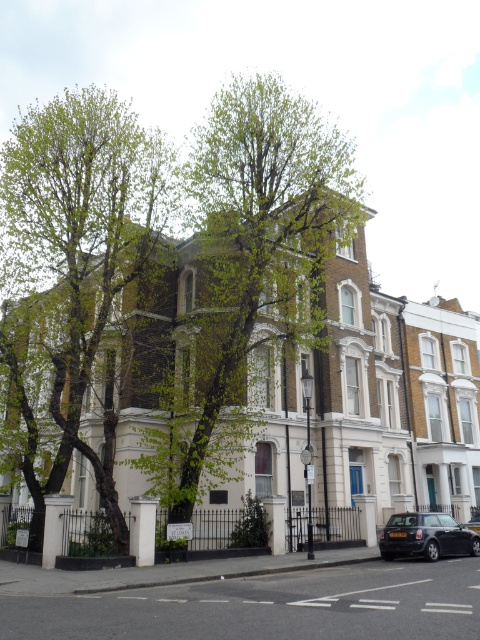
Can you confirm if green leafy tree at center is positioned above black matte car at lower right?

Indeed, green leafy tree at center is positioned over black matte car at lower right.

Does green leafy tree at center appear on the right side of black matte car at lower right?

Incorrect, green leafy tree at center is not on the right side of black matte car at lower right.

Is point (233, 330) positioned in front of point (427, 557)?

No, it is behind (427, 557).

You are a GUI agent. You are given a task and a screenshot of the screen. Output one action in this format:
    pyautogui.click(x=<x>, y=<y>)
    Task: Click on the green leafy tree at center
    Image resolution: width=480 pixels, height=640 pixels.
    Given the screenshot: What is the action you would take?
    pyautogui.click(x=248, y=275)

From the picture: Between black matte car at lower right and shiny black car at center, which one appears on the left side from the viewer's perspective?

black matte car at lower right

Does black matte car at lower right have a greater width compared to shiny black car at center?

No, black matte car at lower right is not wider than shiny black car at center.

Which is behind, point (446, 548) or point (469, 518)?

Positioned behind is point (469, 518).

Find the location of a particular element. black matte car at lower right is located at coordinates (425, 536).

Is green leafy tree at center further to the viewer compared to green leafy tree at left?

Yes, it is behind green leafy tree at left.

Does green leafy tree at center appear on the right side of green leafy tree at left?

Yes, green leafy tree at center is to the right of green leafy tree at left.

The height and width of the screenshot is (640, 480). What do you see at coordinates (248, 275) in the screenshot?
I see `green leafy tree at center` at bounding box center [248, 275].

This screenshot has width=480, height=640. I want to click on green leafy tree at center, so click(x=248, y=275).